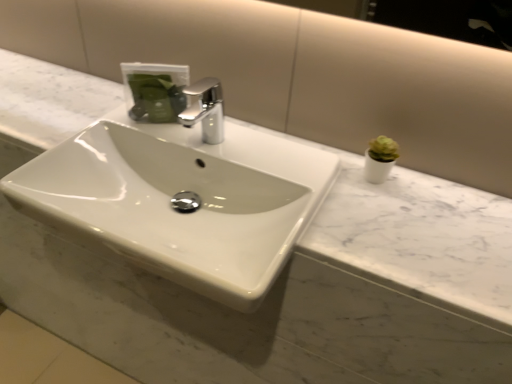
Question: Should I look upward or downward to see white glossy sink at center?

Choices:
 (A) down
 (B) up

Answer: (A)

Question: From the image's perspective, does chrome metallic faucet at center appear lower than white glossy sink at center?

Choices:
 (A) yes
 (B) no

Answer: (B)

Question: From a real-world perspective, is chrome metallic faucet at center positioned under white glossy sink at center based on gravity?

Choices:
 (A) no
 (B) yes

Answer: (A)

Question: Are chrome metallic faucet at center and white glossy sink at center far apart?

Choices:
 (A) yes
 (B) no

Answer: (B)

Question: Is chrome metallic faucet at center further to the viewer compared to white glossy sink at center?

Choices:
 (A) yes
 (B) no

Answer: (A)

Question: Considering the relative sizes of chrome metallic faucet at center and white glossy sink at center in the image provided, is chrome metallic faucet at center shorter than white glossy sink at center?

Choices:
 (A) yes
 (B) no

Answer: (A)

Question: Is chrome metallic faucet at center in contact with white glossy sink at center?

Choices:
 (A) no
 (B) yes

Answer: (A)

Question: Considering the relative positions of white glossy sink at center and chrome metallic faucet at center in the image provided, is white glossy sink at center to the left of chrome metallic faucet at center from the viewer's perspective?

Choices:
 (A) no
 (B) yes

Answer: (B)

Question: Considering the relative sizes of white glossy sink at center and chrome metallic faucet at center in the image provided, is white glossy sink at center thinner than chrome metallic faucet at center?

Choices:
 (A) yes
 (B) no

Answer: (B)

Question: Is white glossy sink at center positioned in front of chrome metallic faucet at center?

Choices:
 (A) no
 (B) yes

Answer: (B)

Question: Can we say white glossy sink at center lies outside chrome metallic faucet at center?

Choices:
 (A) yes
 (B) no

Answer: (A)

Question: Is white glossy sink at center turned away from chrome metallic faucet at center?

Choices:
 (A) no
 (B) yes

Answer: (A)

Question: Is white glossy sink at center smaller than chrome metallic faucet at center?

Choices:
 (A) no
 (B) yes

Answer: (A)

Question: Is point (219, 86) positioned closer to the camera than point (61, 167)?

Choices:
 (A) farther
 (B) closer

Answer: (A)